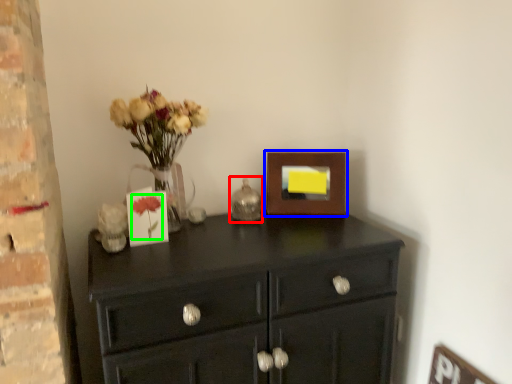
Question: Which object is positioned closest to candle holder (highlighted by a red box)? Select from picture frame (highlighted by a blue box) and flower (highlighted by a green box).

Choices:
 (A) picture frame
 (B) flower

Answer: (A)